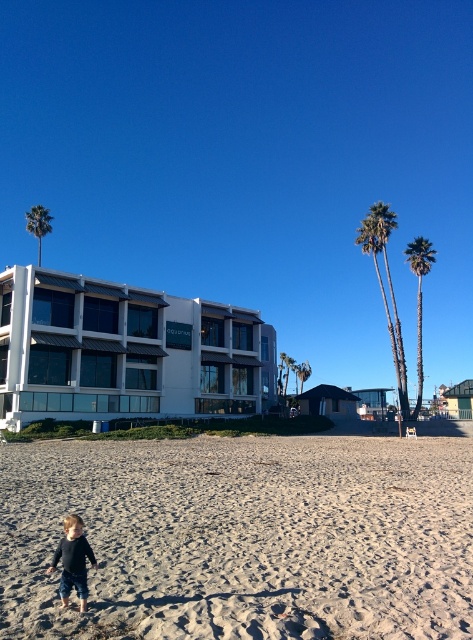
Who is more distant from viewer, (263, 554) or (20, 376)?

The point (20, 376) is behind.

Is point (131, 532) farther from camera compared to point (94, 372)?

No, it is not.

The height and width of the screenshot is (640, 473). I want to click on sandy beach at lower left, so click(243, 538).

What do you see at coordinates (420, 301) in the screenshot?
I see `green leafy palm tree at right` at bounding box center [420, 301].

Looking at this image, can you confirm if green leafy palm tree at right is positioned above green leafy palm tree at upper left?

No, green leafy palm tree at right is not above green leafy palm tree at upper left.

Locate an element on the screen. green leafy palm tree at right is located at coordinates (420, 301).

Between sandy beach at lower left and green leafy palm tree at right, which one has more height?

With more height is green leafy palm tree at right.

Is point (338, 554) behind point (419, 273)?

No, (338, 554) is in front of (419, 273).

Who is more distant from viewer, (367, 547) or (419, 326)?

The point (419, 326) is behind.

This screenshot has height=640, width=473. Find the location of `sandy beach at lower left`. sandy beach at lower left is located at coordinates (243, 538).